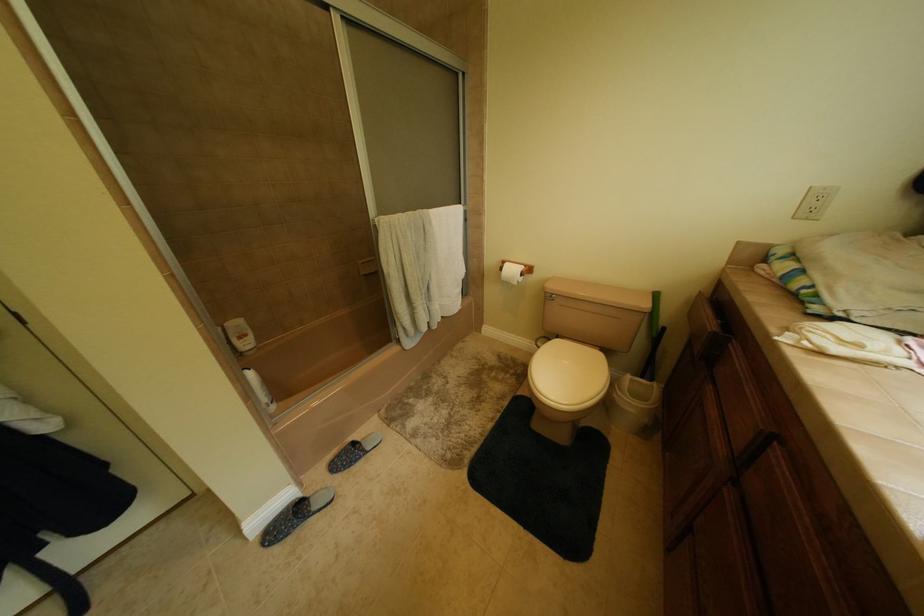
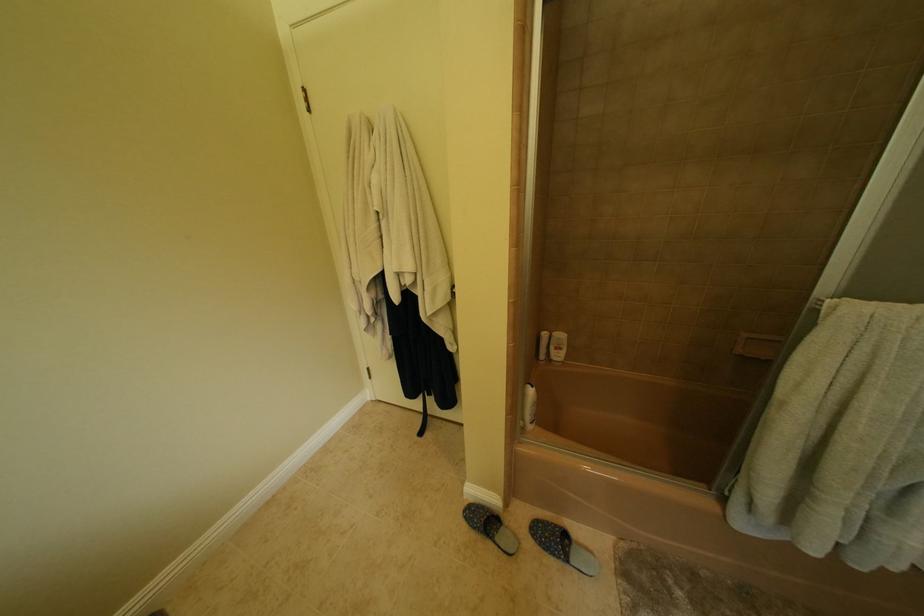
Question: Based on the continuous images, in which direction is the camera rotating? Reply with the corresponding letter.

Choices:
 (A) Left
 (B) Right
 (C) Up
 (D) Down

Answer: (A)